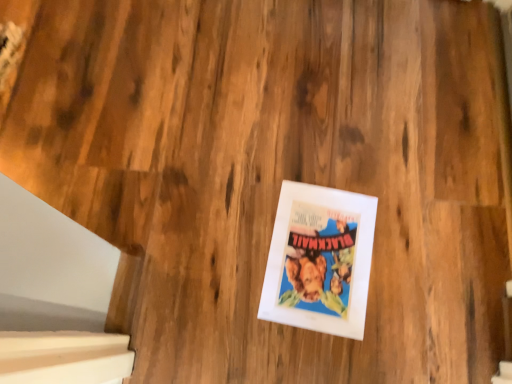
This screenshot has height=384, width=512. I want to click on white matte picture frame at center, so click(320, 260).

Describe the element at coordinates (320, 260) in the screenshot. I see `white matte picture frame at center` at that location.

Image resolution: width=512 pixels, height=384 pixels. In order to click on white matte picture frame at center in this screenshot , I will do `click(320, 260)`.